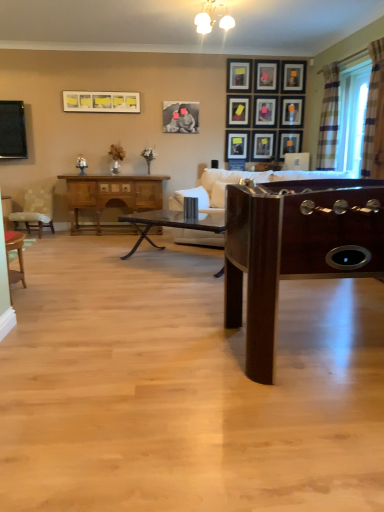
At what (x,y) coordinates should I click in order to perform the action: click on vacant area to the left of shiny dark wood foosball table at right. Please return your answer as a coordinate pair (x, y). The height and width of the screenshot is (512, 384). Looking at the image, I should click on (127, 349).